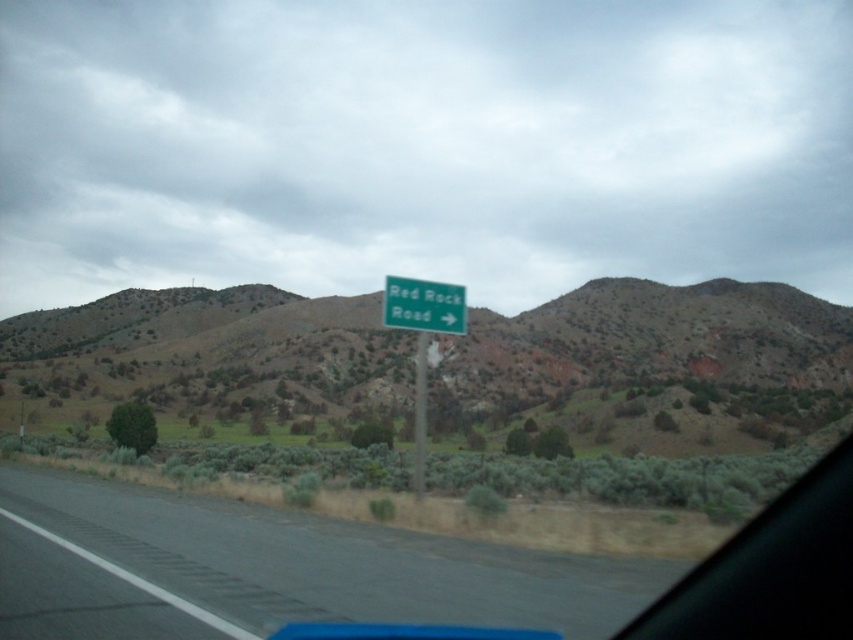
You are driving and see two signs ahead on the road. The green plastic sign at center and the green metallic sign at center. Which one is wider?

The green plastic sign at center is wider than the green metallic sign at center according to the description.

You are driving a car and see the green road sign mounted on a metal pole. There is also a point marked at coordinates [422,339] in the image. What object is located at that point?

The point at coordinates [422,339] indicates the green plastic sign at center.